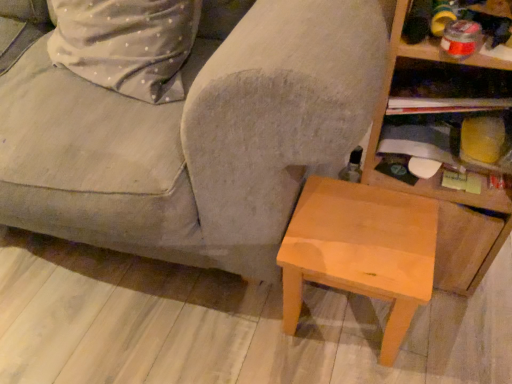
Question: Should I look upward or downward to see wooden at right, the first shelf when ordered from bottom to top?

Choices:
 (A) up
 (B) down

Answer: (A)

Question: Is gray fabric couch at center smaller than wooden shelf at upper right, the 1th shelf positioned from the top?

Choices:
 (A) no
 (B) yes

Answer: (A)

Question: From a real-world perspective, is gray fabric couch at center located beneath wooden shelf at upper right, the 1th shelf positioned from the top?

Choices:
 (A) no
 (B) yes

Answer: (B)

Question: Considering the relative sizes of gray fabric couch at center and wooden shelf at upper right, marked as the 2th shelf in a bottom-to-top arrangement, in the image provided, is gray fabric couch at center shorter than wooden shelf at upper right, marked as the 2th shelf in a bottom-to-top arrangement,?

Choices:
 (A) yes
 (B) no

Answer: (B)

Question: From the image's perspective, would you say gray fabric couch at center is shown under wooden shelf at upper right, marked as the 2th shelf in a bottom-to-top arrangement?

Choices:
 (A) yes
 (B) no

Answer: (B)

Question: Is gray fabric couch at center bigger than wooden shelf at upper right, the 1th shelf positioned from the top?

Choices:
 (A) yes
 (B) no

Answer: (A)

Question: Is gray fabric couch at center to the left of wooden shelf at upper right, the 1th shelf positioned from the top, from the viewer's perspective?

Choices:
 (A) yes
 (B) no

Answer: (A)

Question: Is gray fabric couch at center at the right side of light brown wood stool at lower right?

Choices:
 (A) no
 (B) yes

Answer: (A)

Question: Does gray fabric couch at center contain light brown wood stool at lower right?

Choices:
 (A) no
 (B) yes

Answer: (B)

Question: Is gray fabric couch at center behind light brown wood stool at lower right?

Choices:
 (A) yes
 (B) no

Answer: (B)

Question: Is gray fabric couch at center bigger than light brown wood stool at lower right?

Choices:
 (A) no
 (B) yes

Answer: (B)

Question: Would you say gray fabric couch at center is outside light brown wood stool at lower right?

Choices:
 (A) no
 (B) yes

Answer: (B)

Question: From a real-world perspective, is gray fabric couch at center physically below light brown wood stool at lower right?

Choices:
 (A) yes
 (B) no

Answer: (B)

Question: Is light brown wood stool at lower right facing towards wooden shelf at upper right, marked as the 2th shelf in a bottom-to-top arrangement?

Choices:
 (A) no
 (B) yes

Answer: (A)